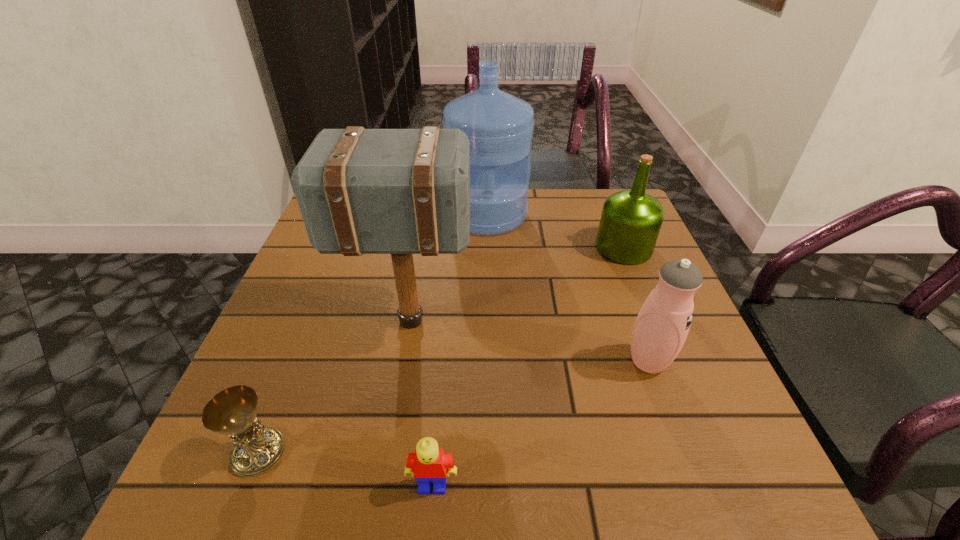
Where is `vacant position in the image that satisfies the following two spatial constraints: 1. on the striking surface of the thermos bottle; 2. on the right side of the mallet`? This screenshot has height=540, width=960. vacant position in the image that satisfies the following two spatial constraints: 1. on the striking surface of the thermos bottle; 2. on the right side of the mallet is located at coordinates (403, 361).

What are the coordinates of `vacant space that satisfies the following two spatial constraints: 1. on the back side of the olive oil; 2. on the right side of the thermos bottle` in the screenshot? It's located at (608, 248).

Image resolution: width=960 pixels, height=540 pixels. I want to click on free spot that satisfies the following two spatial constraints: 1. on the side of the water jug with the handle; 2. on the striking surface of the mallet, so click(x=490, y=321).

I want to click on free spot that satisfies the following two spatial constraints: 1. on the striking surface of the thermos bottle; 2. on the left side of the mallet, so click(403, 361).